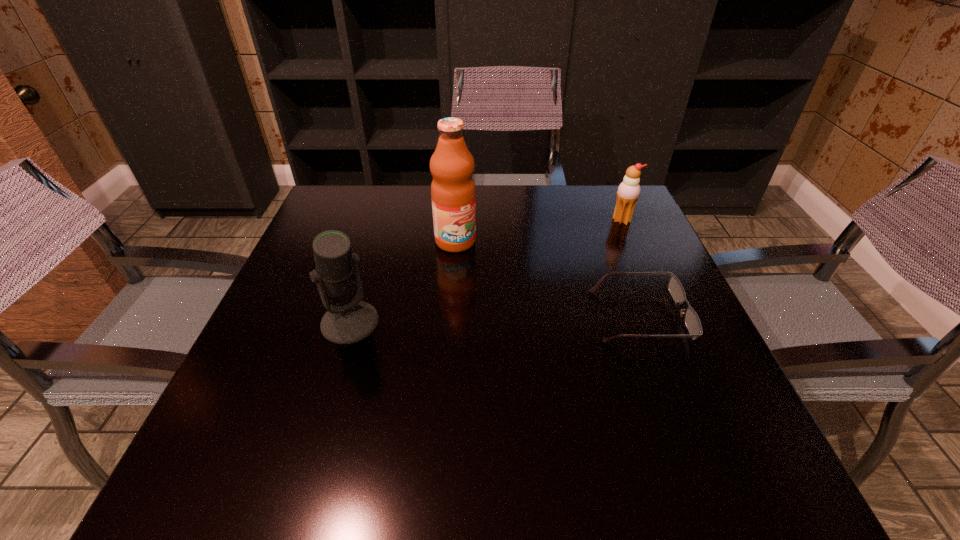
Locate an element on the screen. Image resolution: width=960 pixels, height=540 pixels. the third shortest object is located at coordinates (352, 320).

Locate an element on the screen. the leftmost object is located at coordinates (352, 320).

Locate an element on the screen. The width and height of the screenshot is (960, 540). the shortest object is located at coordinates (692, 321).

Image resolution: width=960 pixels, height=540 pixels. What are the coordinates of `the third nearest object` in the screenshot? It's located at (453, 193).

This screenshot has width=960, height=540. I want to click on the tallest object, so click(453, 193).

At what (x,y) coordinates should I click in order to perform the action: click on icecream. Please return your answer as a coordinate pair (x, y). Image resolution: width=960 pixels, height=540 pixels. Looking at the image, I should click on (628, 192).

Locate an element on the screen. The image size is (960, 540). the farthest object is located at coordinates (628, 192).

Identify the location of vacant space positioned 0.400m on the back of the third shortest object. (386, 205).

Locate an element on the screen. free spot located 0.090m on the front label of the tallest object is located at coordinates (482, 273).

This screenshot has width=960, height=540. Identify the location of vacant space located on the front label of the tallest object. (502, 296).